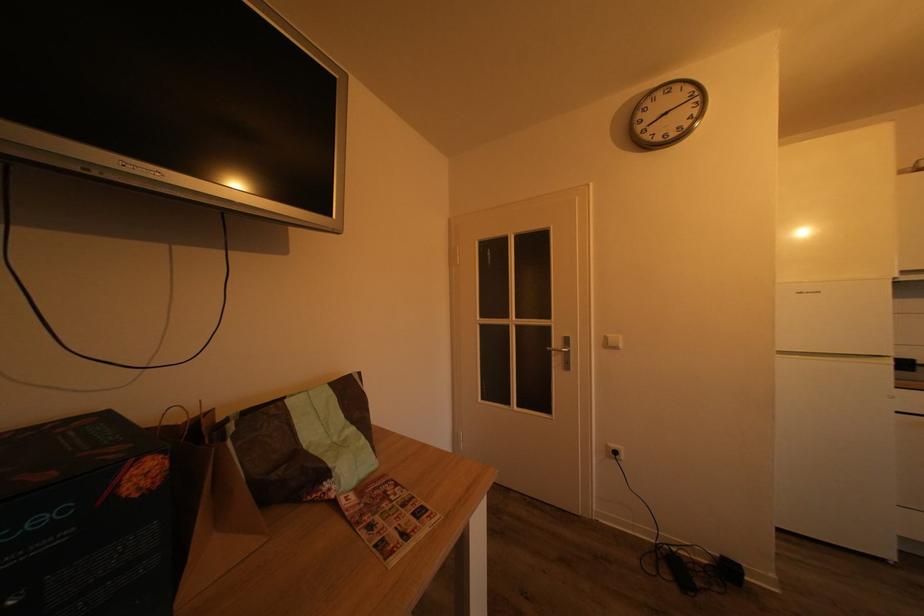
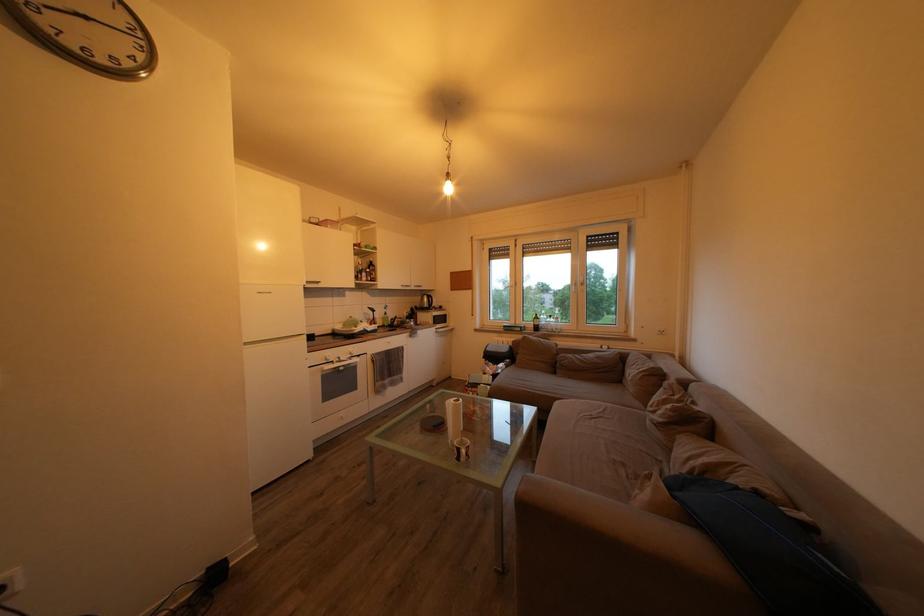
Question: The camera is either moving clockwise (left) or counter-clockwise (right) around the object. The first image is from the beginning of the video and the second image is from the end. Is the camera moving left or right when shooting the video?

Choices:
 (A) Left
 (B) Right

Answer: (A)